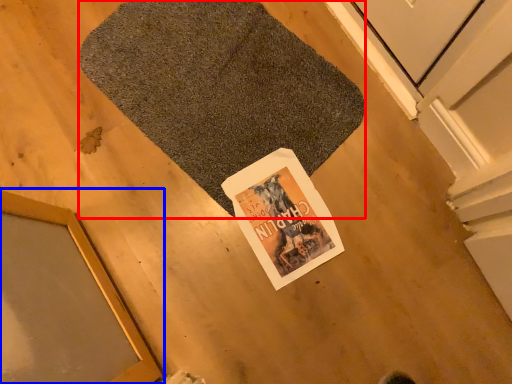
Question: Which point is further to the camera, bath mat (highlighted by a red box) or window (highlighted by a blue box)?

Choices:
 (A) bath mat
 (B) window

Answer: (A)